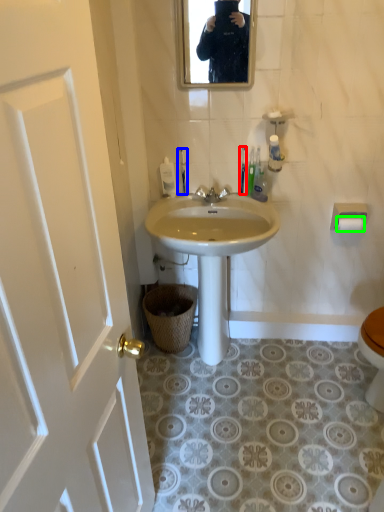
Question: Which is nearer to the toilet brush (highlighted by a red box)? toilet brush (highlighted by a blue box) or toilet paper (highlighted by a green box).

Choices:
 (A) toilet brush
 (B) toilet paper

Answer: (A)